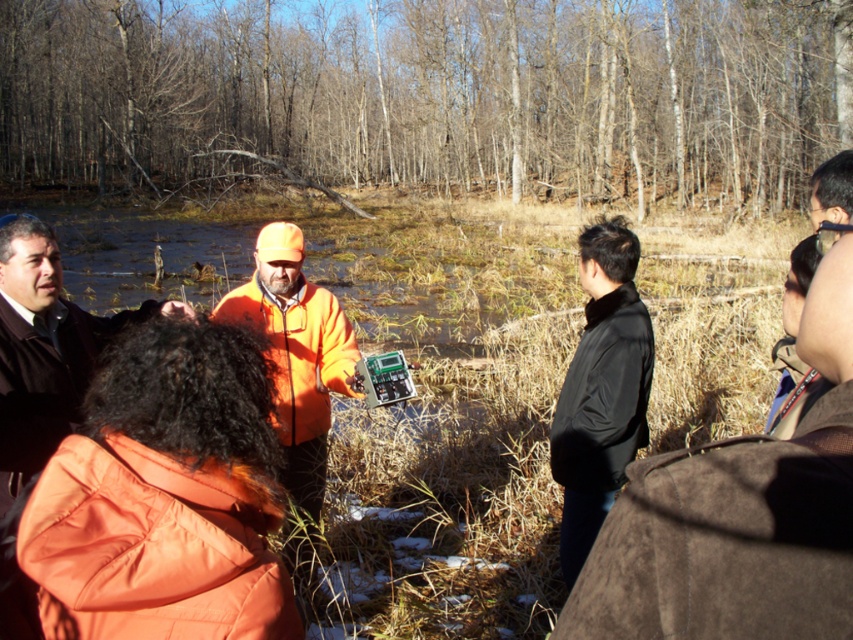
Is orange puffy jacket at lower left in front of black smooth jacket at center?

Yes, orange puffy jacket at lower left is closer to the viewer.

Who is shorter, orange puffy jacket at lower left or black smooth jacket at center?

Standing shorter between the two is black smooth jacket at center.

You are a GUI agent. You are given a task and a screenshot of the screen. Output one action in this format:
    pyautogui.click(x=<x>, y=<y>)
    Task: Click on the orange puffy jacket at lower left
    
    Given the screenshot: What is the action you would take?
    pyautogui.click(x=38, y=387)

At what (x,y) coordinates should I click in order to perform the action: click on orange puffy jacket at lower left. Please return your answer as a coordinate pair (x, y). Looking at the image, I should click on (38, 387).

Is black suede jacket at upper right to the right of black smooth jacket at center from the viewer's perspective?

No, black suede jacket at upper right is not to the right of black smooth jacket at center.

Can you confirm if black suede jacket at upper right is thinner than black smooth jacket at center?

No.

Who is more forward, [717,456] or [579,486]?

Point [717,456] is more forward.

Identify the location of black suede jacket at upper right. The width and height of the screenshot is (853, 640). (740, 515).

Is point (648, 365) closer to camera compared to point (345, 336)?

That is True.

Is point (604, 326) less distant than point (241, 296)?

Yes, point (604, 326) is closer to viewer.

Identify the location of black smooth jacket at center. (601, 390).